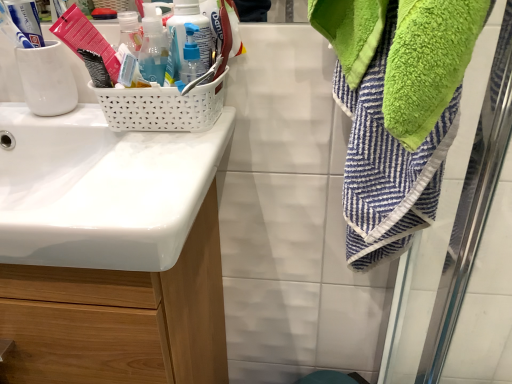
Question: Is translucent plastic soap dispenser at upper left, which is counted as the 1th bottle, starting from the left, turned away from white glossy sink at left?

Choices:
 (A) yes
 (B) no

Answer: (B)

Question: From the image's perspective, is translucent plastic soap dispenser at upper left, which ranks as the 3th bottle in right-to-left order, on white glossy sink at left?

Choices:
 (A) yes
 (B) no

Answer: (A)

Question: Considering the relative sizes of translucent plastic soap dispenser at upper left, which ranks as the 3th bottle in right-to-left order, and white glossy sink at left in the image provided, is translucent plastic soap dispenser at upper left, which ranks as the 3th bottle in right-to-left order, taller than white glossy sink at left?

Choices:
 (A) yes
 (B) no

Answer: (A)

Question: Is translucent plastic soap dispenser at upper left, which is counted as the 1th bottle, starting from the left, shorter than white glossy sink at left?

Choices:
 (A) yes
 (B) no

Answer: (B)

Question: Is translucent plastic soap dispenser at upper left, which ranks as the 3th bottle in right-to-left order, not inside white glossy sink at left?

Choices:
 (A) no
 (B) yes

Answer: (B)

Question: Can white glossy sink at left be found inside translucent plastic soap dispenser at upper left, which ranks as the 3th bottle in right-to-left order?

Choices:
 (A) yes
 (B) no

Answer: (B)

Question: Is translucent plastic pump bottle at upper center, acting as the second bottle starting from the left, behind translucent plastic pump bottle at center, placed as the 3th bottle when sorted from left to right?

Choices:
 (A) yes
 (B) no

Answer: (A)

Question: From a real-world perspective, is translucent plastic pump bottle at upper center, acting as the second bottle starting from the left, over translucent plastic pump bottle at center, arranged as the 1th bottle when viewed from the right?

Choices:
 (A) no
 (B) yes

Answer: (B)

Question: Would you consider translucent plastic pump bottle at upper center, positioned as the 2th bottle in right-to-left order, to be distant from translucent plastic pump bottle at center, arranged as the 1th bottle when viewed from the right?

Choices:
 (A) yes
 (B) no

Answer: (B)

Question: From the image's perspective, is translucent plastic pump bottle at upper center, acting as the second bottle starting from the left, on top of translucent plastic pump bottle at center, arranged as the 1th bottle when viewed from the right?

Choices:
 (A) yes
 (B) no

Answer: (A)

Question: Considering the relative positions of translucent plastic pump bottle at upper center, acting as the second bottle starting from the left, and translucent plastic pump bottle at center, placed as the 3th bottle when sorted from left to right, in the image provided, is translucent plastic pump bottle at upper center, acting as the second bottle starting from the left, to the left of translucent plastic pump bottle at center, placed as the 3th bottle when sorted from left to right, from the viewer's perspective?

Choices:
 (A) no
 (B) yes

Answer: (B)

Question: Is the depth of translucent plastic pump bottle at upper center, acting as the second bottle starting from the left, less than that of translucent plastic pump bottle at center, placed as the 3th bottle when sorted from left to right?

Choices:
 (A) no
 (B) yes

Answer: (A)

Question: From a real-world perspective, is translucent plastic pump bottle at center, arranged as the 1th bottle when viewed from the right, positioned over white glossy sink at left based on gravity?

Choices:
 (A) yes
 (B) no

Answer: (A)